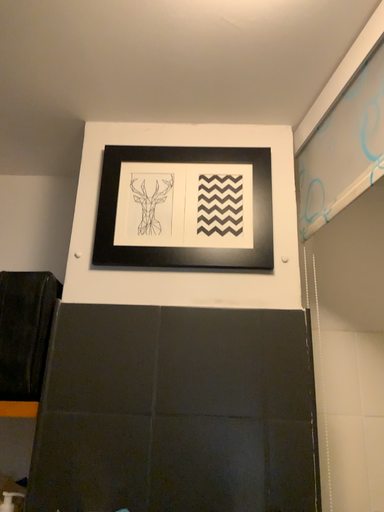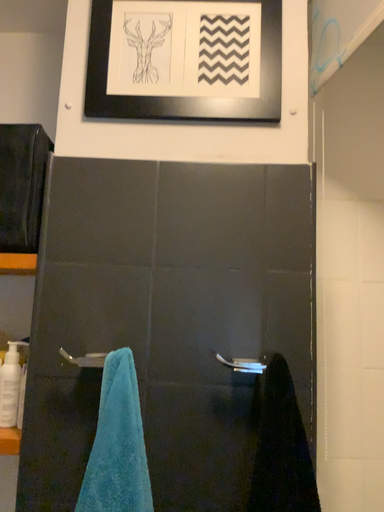
Question: Which way did the camera rotate in the video?

Choices:
 (A) rotated upward
 (B) rotated downward

Answer: (B)